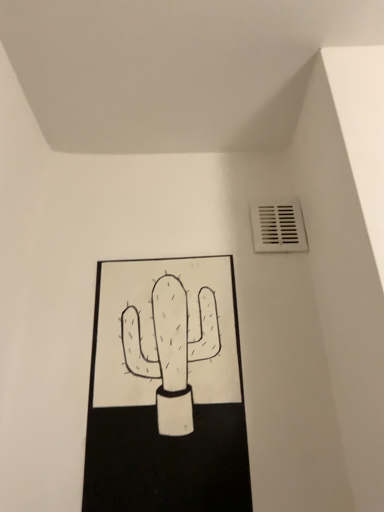
The height and width of the screenshot is (512, 384). I want to click on white matte cactus at center, so click(x=166, y=389).

Describe the element at coordinates (166, 389) in the screenshot. This screenshot has height=512, width=384. I see `white matte cactus at center` at that location.

This screenshot has width=384, height=512. What do you see at coordinates (278, 227) in the screenshot?
I see `white plastic vent at upper right` at bounding box center [278, 227].

Find the location of a particular element. The image size is (384, 512). white plastic vent at upper right is located at coordinates [278, 227].

The height and width of the screenshot is (512, 384). In order to click on white matte cactus at center in this screenshot , I will do `click(166, 389)`.

Considering the relative positions of white matte cactus at center and white plastic vent at upper right in the image provided, is white matte cactus at center to the left of white plastic vent at upper right from the viewer's perspective?

Yes.

Does white matte cactus at center lie in front of white plastic vent at upper right?

Yes, it is.

Is point (105, 448) more distant than point (271, 234)?

No, (105, 448) is closer to viewer.

From the image's perspective, does white matte cactus at center appear lower than white plastic vent at upper right?

Indeed, from the image's perspective, white matte cactus at center is shown beneath white plastic vent at upper right.

From a real-world perspective, is white matte cactus at center positioned over white plastic vent at upper right based on gravity?

No, from a real-world perspective, white matte cactus at center is not above white plastic vent at upper right.

Which of these two, white matte cactus at center or white plastic vent at upper right, is wider?

white matte cactus at center is wider.

Can you confirm if white matte cactus at center is taller than white plastic vent at upper right?

Yes.

Can you confirm if white matte cactus at center is smaller than white plastic vent at upper right?

No.

Is white plastic vent at upper right inside white matte cactus at center?

No, white plastic vent at upper right is located outside of white matte cactus at center.

Is white matte cactus at center next to white plastic vent at upper right and touching it?

No, white matte cactus at center is not beside white plastic vent at upper right.

From the picture: Could you tell me if white matte cactus at center is turned towards white plastic vent at upper right?

No, white matte cactus at center does not turn towards white plastic vent at upper right.

Identify the location of air conditioning behind the white matte cactus at center. (278, 227).

Would you say white plastic vent at upper right is to the left or to the right of white matte cactus at center in the picture?

white plastic vent at upper right is to the right of white matte cactus at center.

Relative to white matte cactus at center, is white plastic vent at upper right in front or behind?

Visually, white plastic vent at upper right is located behind white matte cactus at center.

Considering the points (280, 207) and (111, 370), which point is in front, point (280, 207) or point (111, 370)?

Positioned in front is point (111, 370).

From the image's perspective, which object appears higher, white plastic vent at upper right or white matte cactus at center?

white plastic vent at upper right appears higher in the image.

From a real-world perspective, is white plastic vent at upper right physically above white matte cactus at center?

Yes, from a real-world perspective, white plastic vent at upper right is over white matte cactus at center

Considering the sizes of white plastic vent at upper right and white matte cactus at center in the image, is white plastic vent at upper right wider or thinner than white matte cactus at center?

white plastic vent at upper right is thinner than white matte cactus at center.

Considering the sizes of objects white plastic vent at upper right and white matte cactus at center in the image provided, who is taller, white plastic vent at upper right or white matte cactus at center?

white matte cactus at center is taller.

Considering the sizes of white plastic vent at upper right and white matte cactus at center in the image, is white plastic vent at upper right bigger or smaller than white matte cactus at center?

Clearly, white plastic vent at upper right is smaller in size than white matte cactus at center.

Is white plastic vent at upper right positioned beyond the bounds of white matte cactus at center?

Yes.

Is white plastic vent at upper right next to white matte cactus at center?

They are not placed beside each other.

Based on the photo, is white matte cactus at center at the back of white plastic vent at upper right?

No, white plastic vent at upper right is not facing away from white matte cactus at center.

How different are the orientations of white plastic vent at upper right and white matte cactus at center in degrees?

white plastic vent at upper right and white matte cactus at center are facing 2.38 degrees away from each other.

The height and width of the screenshot is (512, 384). In order to click on sketch below the white plastic vent at upper right (from the image's perspective) in this screenshot , I will do `click(166, 389)`.

In the image, there is a white plastic vent at upper right. Identify the location of sketch below it (from the image's perspective). (166, 389).

Identify the location of air conditioning to the right of white matte cactus at center. This screenshot has width=384, height=512. (278, 227).